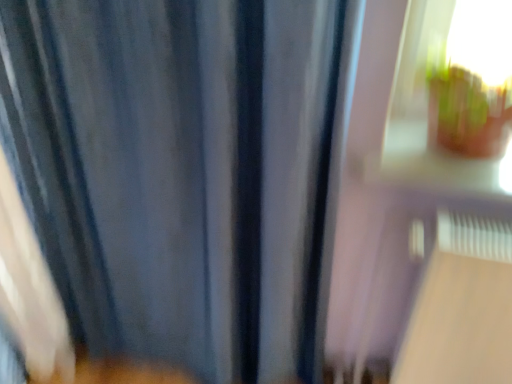
Question: Does blue fabric curtain at center turn towards transparent glass window at upper right?

Choices:
 (A) yes
 (B) no

Answer: (B)

Question: Is blue fabric curtain at center in contact with transparent glass window at upper right?

Choices:
 (A) yes
 (B) no

Answer: (B)

Question: From the image's perspective, is blue fabric curtain at center over transparent glass window at upper right?

Choices:
 (A) no
 (B) yes

Answer: (A)

Question: Would you say blue fabric curtain at center is a long distance from transparent glass window at upper right?

Choices:
 (A) yes
 (B) no

Answer: (B)

Question: Is blue fabric curtain at center to the right of transparent glass window at upper right from the viewer's perspective?

Choices:
 (A) no
 (B) yes

Answer: (A)

Question: Can you confirm if blue fabric curtain at center is shorter than transparent glass window at upper right?

Choices:
 (A) no
 (B) yes

Answer: (A)

Question: From a real-world perspective, is transparent glass window at upper right located higher than blue fabric curtain at center?

Choices:
 (A) no
 (B) yes

Answer: (B)

Question: Is transparent glass window at upper right oriented towards blue fabric curtain at center?

Choices:
 (A) yes
 (B) no

Answer: (B)

Question: Is blue fabric curtain at center at the back of transparent glass window at upper right?

Choices:
 (A) no
 (B) yes

Answer: (A)

Question: Can you confirm if transparent glass window at upper right is thinner than blue fabric curtain at center?

Choices:
 (A) yes
 (B) no

Answer: (B)

Question: Is transparent glass window at upper right next to blue fabric curtain at center?

Choices:
 (A) no
 (B) yes

Answer: (A)

Question: Would you say blue fabric curtain at center is part of transparent glass window at upper right's contents?

Choices:
 (A) yes
 (B) no

Answer: (B)

Question: Looking at the image, does transparent glass window at upper right seem bigger or smaller compared to blue fabric curtain at center?

Choices:
 (A) small
 (B) big

Answer: (A)